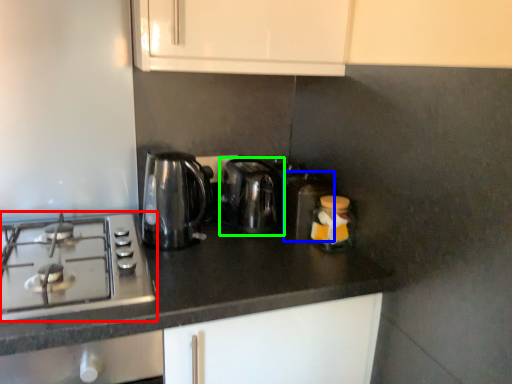
Question: Which is farther away from gas stove (highlighted by a red box)? appliance (highlighted by a blue box) or kitchen appliance (highlighted by a green box)?

Choices:
 (A) appliance
 (B) kitchen appliance

Answer: (A)